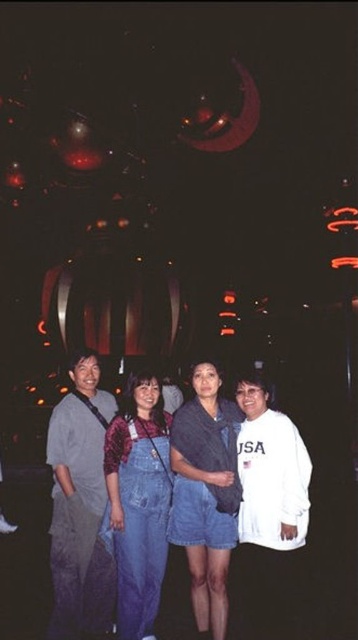
Is gray cotton shirt at left taller than denim overalls at center?

Correct, gray cotton shirt at left is much taller as denim overalls at center.

Can you confirm if gray cotton shirt at left is smaller than denim overalls at center?

No.

Consider the image. Who is more distant from viewer, (109, 598) or (133, 497)?

The point (133, 497) is more distant.

This screenshot has height=640, width=358. What are the coordinates of `gray cotton shirt at left` in the screenshot? It's located at (79, 504).

Can you confirm if white matte sweatshirt at lower right is taller than denim overalls at center?

No, white matte sweatshirt at lower right is not taller than denim overalls at center.

Between point (263, 454) and point (150, 547), which one is positioned behind?

Positioned behind is point (150, 547).

I want to click on white matte sweatshirt at lower right, so click(271, 512).

Who is more forward, (54, 532) or (191, 483)?

Positioned in front is point (191, 483).

Between gray cotton shirt at left and denim skirt at center, which one is positioned lower?

gray cotton shirt at left is lower down.

Locate an element on the screen. This screenshot has width=358, height=640. gray cotton shirt at left is located at coordinates (79, 504).